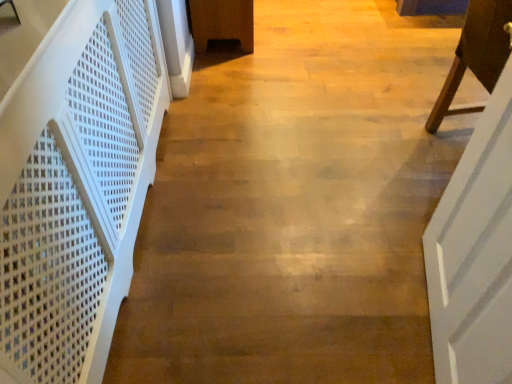
Question: Looking at their shapes, would you say white plastic stairwell at left is wider or thinner than white wooden door at right?

Choices:
 (A) wide
 (B) thin

Answer: (A)

Question: From their relative heights in the image, would you say white plastic stairwell at left is taller or shorter than white wooden door at right?

Choices:
 (A) short
 (B) tall

Answer: (B)

Question: Which of these objects is positioned farthest from the white wooden door at right?

Choices:
 (A) white plastic stairwell at left
 (B) brown wooden chair at right

Answer: (A)

Question: Estimate the real-world distances between objects in this image. Which object is farther from the white wooden door at right?

Choices:
 (A) brown wooden chair at right
 (B) white plastic stairwell at left

Answer: (B)